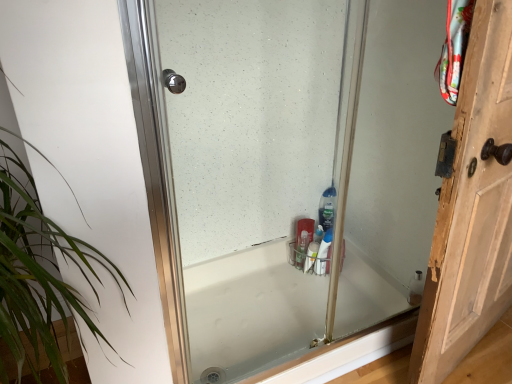
This screenshot has height=384, width=512. What do you see at coordinates (252, 312) in the screenshot?
I see `white glossy bathtub at center` at bounding box center [252, 312].

Identify the location of wooden door at right. This screenshot has height=384, width=512. (471, 208).

In order to click on green leafy plant at left in this screenshot , I will do `click(39, 274)`.

This screenshot has height=384, width=512. Find the location of `clear plastic bottle at center, positioned as the 1th cleaning product in back-to-front order`. clear plastic bottle at center, positioned as the 1th cleaning product in back-to-front order is located at coordinates (327, 208).

From the picture: From their relative heights in the image, would you say green leafy plant at left is taller or shorter than wooden door at right?

In the image, green leafy plant at left appears to be taller than wooden door at right.

Between green leafy plant at left and wooden door at right, which one appears on the left side from the viewer's perspective?

From the viewer's perspective, green leafy plant at left appears more on the left side.

Is green leafy plant at left placed right next to wooden door at right?

No, green leafy plant at left is not touching wooden door at right.

The image size is (512, 384). Find the location of `door on the right of green leafy plant at left`. door on the right of green leafy plant at left is located at coordinates (471, 208).

From the picture: Is white glossy bathtub at center not inside wooden door at right?

white glossy bathtub at center lies outside wooden door at right's area.

Looking at their sizes, would you say white glossy bathtub at center is wider or thinner than wooden door at right?

In the image, white glossy bathtub at center appears to be wider than wooden door at right.

Does point (284, 283) come farther from viewer compared to point (469, 49)?

That is True.

From the picture: Which is in front, white glossy bathtub at center or wooden door at right?

wooden door at right.

Can you confirm if clear plastic bottle at center, positioned as the 1th cleaning product in back-to-front order, is positioned to the right of wooden door at right?

In fact, clear plastic bottle at center, positioned as the 1th cleaning product in back-to-front order, is to the left of wooden door at right.

Looking at their sizes, would you say clear plastic bottle at center, arranged as the 2th cleaning product when ordered from the bottom, is wider or thinner than wooden door at right?

Considering their sizes, clear plastic bottle at center, arranged as the 2th cleaning product when ordered from the bottom, looks slimmer than wooden door at right.

Is wooden door at right located within clear plastic bottle at center, the second cleaning product when ordered from front to back?

Definitely not — wooden door at right is not inside clear plastic bottle at center, the second cleaning product when ordered from front to back.

Looking at the image, does clear plastic bottle at center, which appears as the 1th cleaning product when viewed from the top, seem bigger or smaller compared to wooden door at right?

Clearly, clear plastic bottle at center, which appears as the 1th cleaning product when viewed from the top, is smaller in size than wooden door at right.

How many degrees apart are the facing directions of white glossy bathtub at center and clear plastic bottle at center, positioned as the 1th cleaning product in back-to-front order?

The facing directions of white glossy bathtub at center and clear plastic bottle at center, positioned as the 1th cleaning product in back-to-front order, are 13 degrees apart.

Based on the photo, from the image's perspective, is white glossy bathtub at center located above or below clear plastic bottle at center, which appears as the 1th cleaning product when viewed from the top?

white glossy bathtub at center is situated lower than clear plastic bottle at center, which appears as the 1th cleaning product when viewed from the top, in the image.

Which is behind, white glossy bathtub at center or clear plastic bottle at center, positioned as the 1th cleaning product in back-to-front order?

clear plastic bottle at center, positioned as the 1th cleaning product in back-to-front order, is more distant.

Considering the relative positions of white glossy bathtub at center and clear plastic bottle at center, arranged as the 2th cleaning product when ordered from the bottom, in the image provided, is white glossy bathtub at center to the left of clear plastic bottle at center, arranged as the 2th cleaning product when ordered from the bottom, from the viewer's perspective?

Correct, you'll find white glossy bathtub at center to the left of clear plastic bottle at center, arranged as the 2th cleaning product when ordered from the bottom.

Is white glossy bottle at lower right, the 2th cleaning product positioned from the top, inside clear glass shower door at center?

That's incorrect, white glossy bottle at lower right, the 2th cleaning product positioned from the top, is not inside clear glass shower door at center.

Does clear glass shower door at center have a larger size compared to white glossy bottle at lower right, the first cleaning product viewed from the front?

Correct, clear glass shower door at center is larger in size than white glossy bottle at lower right, the first cleaning product viewed from the front.

How many degrees apart are the facing directions of clear glass shower door at center and white glossy bottle at lower right, the first cleaning product viewed from the front?

There is a 14-degree angle between the facing directions of clear glass shower door at center and white glossy bottle at lower right, the first cleaning product viewed from the front.

Does clear glass shower door at center have a lesser height compared to white glossy bottle at lower right, the 1th cleaning product in the bottom-to-top sequence?

No.

Considering the sizes of white glossy bottle at lower right, which is counted as the second cleaning product, starting from the back, and white glossy bathtub at center in the image, is white glossy bottle at lower right, which is counted as the second cleaning product, starting from the back, bigger or smaller than white glossy bathtub at center?

In the image, white glossy bottle at lower right, which is counted as the second cleaning product, starting from the back, appears to be smaller than white glossy bathtub at center.

In terms of width, does white glossy bottle at lower right, the 1th cleaning product in the bottom-to-top sequence, look wider or thinner when compared to white glossy bathtub at center?

Clearly, white glossy bottle at lower right, the 1th cleaning product in the bottom-to-top sequence, has less width compared to white glossy bathtub at center.

Is point (318, 274) farther from camera compared to point (346, 366)?

Yes, point (318, 274) is farther from viewer.

From the image's perspective, is white glossy bottle at lower right, which is counted as the second cleaning product, starting from the back, on top of white glossy bathtub at center?

Yes, from the image's perspective, white glossy bottle at lower right, which is counted as the second cleaning product, starting from the back, is over white glossy bathtub at center.

Does white glossy bottle at lower right, the first cleaning product viewed from the front, have a smaller size compared to clear plastic bottle at center, which appears as the 1th cleaning product when viewed from the top?

Actually, white glossy bottle at lower right, the first cleaning product viewed from the front, might be larger than clear plastic bottle at center, which appears as the 1th cleaning product when viewed from the top.

Looking at this image, considering the sizes of objects white glossy bottle at lower right, the first cleaning product viewed from the front, and clear plastic bottle at center, positioned as the 1th cleaning product in back-to-front order, in the image provided, who is taller, white glossy bottle at lower right, the first cleaning product viewed from the front, or clear plastic bottle at center, positioned as the 1th cleaning product in back-to-front order,?

white glossy bottle at lower right, the first cleaning product viewed from the front, is taller.

Is white glossy bottle at lower right, the 2th cleaning product positioned from the top, turned away from clear plastic bottle at center, positioned as the 1th cleaning product in back-to-front order?

No, white glossy bottle at lower right, the 2th cleaning product positioned from the top, is not facing the opposite direction of clear plastic bottle at center, positioned as the 1th cleaning product in back-to-front order.

From the image's perspective, who appears lower, white glossy bottle at lower right, the first cleaning product viewed from the front, or clear plastic bottle at center, which appears as the 1th cleaning product when viewed from the top?

white glossy bottle at lower right, the first cleaning product viewed from the front, appears lower in the image.

Find the location of `door to the right of green leafy plant at left`. door to the right of green leafy plant at left is located at coordinates (471, 208).

The image size is (512, 384). I want to click on door above the white glossy bathtub at center (from a real-world perspective), so click(471, 208).

When comparing their distances from wooden door at right, does clear plastic bottle at center, the second cleaning product when ordered from front to back, or white glossy bottle at lower right, the 1th cleaning product in the bottom-to-top sequence, seem closer?

clear plastic bottle at center, the second cleaning product when ordered from front to back.

Based on their spatial positions, is green leafy plant at left or wooden door at right closer to white glossy bottle at lower right, the 1th cleaning product in the bottom-to-top sequence?

Among the two, wooden door at right is located nearer to white glossy bottle at lower right, the 1th cleaning product in the bottom-to-top sequence.

Estimate the real-world distances between objects in this image. Which object is closer to white glossy bottle at lower right, the 2th cleaning product positioned from the top, white glossy bathtub at center or green leafy plant at left?

The object closer to white glossy bottle at lower right, the 2th cleaning product positioned from the top, is white glossy bathtub at center.

In the scene shown: Considering their positions, is clear plastic bottle at center, positioned as the 1th cleaning product in back-to-front order, positioned closer to clear glass shower door at center than wooden door at right?

Based on the image, clear plastic bottle at center, positioned as the 1th cleaning product in back-to-front order, appears to be nearer to clear glass shower door at center.

From the image, which object appears to be nearer to clear plastic bottle at center, the second cleaning product when ordered from front to back, green leafy plant at left or wooden door at right?

Among the two, wooden door at right is located nearer to clear plastic bottle at center, the second cleaning product when ordered from front to back.

Based on their spatial positions, is clear glass shower door at center or clear plastic bottle at center, positioned as the 1th cleaning product in back-to-front order, further from wooden door at right?

Based on the image, clear glass shower door at center appears to be further to wooden door at right.

Looking at the image, which one is located further to white glossy bathtub at center, white glossy bottle at lower right, the 1th cleaning product in the bottom-to-top sequence, or clear glass shower door at center?

white glossy bottle at lower right, the 1th cleaning product in the bottom-to-top sequence, is further to white glossy bathtub at center.

Estimate the real-world distances between objects in this image. Which object is further from wooden door at right, clear glass shower door at center or green leafy plant at left?

green leafy plant at left.

The height and width of the screenshot is (384, 512). I want to click on bathtub situated between green leafy plant at left and wooden door at right from left to right, so click(252, 312).

Locate an element on the screen. The image size is (512, 384). door between green leafy plant at left and white glossy bottle at lower right, the 1th cleaning product in the bottom-to-top sequence, along the z-axis is located at coordinates (471, 208).

Identify the location of bathtub located between clear glass shower door at center and white glossy bottle at lower right, the 2th cleaning product positioned from the top, in the depth direction. (252, 312).

The height and width of the screenshot is (384, 512). In order to click on glass door between green leafy plant at left and clear plastic bottle at center, which appears as the 1th cleaning product when viewed from the top, from front to back in this screenshot , I will do `click(282, 167)`.